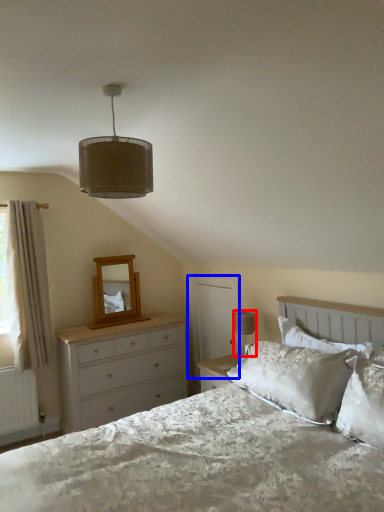
Question: Which object appears farthest to the camera in this image, table lamp (highlighted by a red box) or screen door (highlighted by a blue box)?

Choices:
 (A) table lamp
 (B) screen door

Answer: (B)